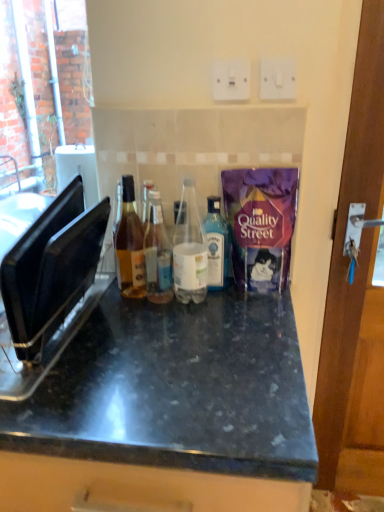
Question: Is point (226, 282) positioned closer to the camera than point (147, 257)?

Choices:
 (A) farther
 (B) closer

Answer: (A)

Question: Relative to translucent glass bottle at center, the second bottle in the left-to-right sequence, is blue glass bottle at center, which ranks as the 4th bottle in left-to-right order, in front or behind?

Choices:
 (A) behind
 (B) front

Answer: (A)

Question: Estimate the real-world distances between objects in this image. Which object is farther from the blue glass bottle at center, the first bottle viewed from the right?

Choices:
 (A) black plastic toaster at left
 (B) translucent glass bottle at center, the second bottle in the left-to-right sequence
 (C) black granite countertop at center
 (D) amber glass bottle at center, the 1th bottle in the left-to-right sequence
 (E) wooden door at right

Answer: (E)

Question: Estimate the real-world distances between objects in this image. Which object is closer to the black granite countertop at center?

Choices:
 (A) black plastic toaster at left
 (B) wooden door at right
 (C) amber glass bottle at center, the 1th bottle in the left-to-right sequence
 (D) white plastic switch at upper center, the first electric outlet viewed from the right
 (E) blue glass bottle at center, which ranks as the 4th bottle in left-to-right order

Answer: (A)